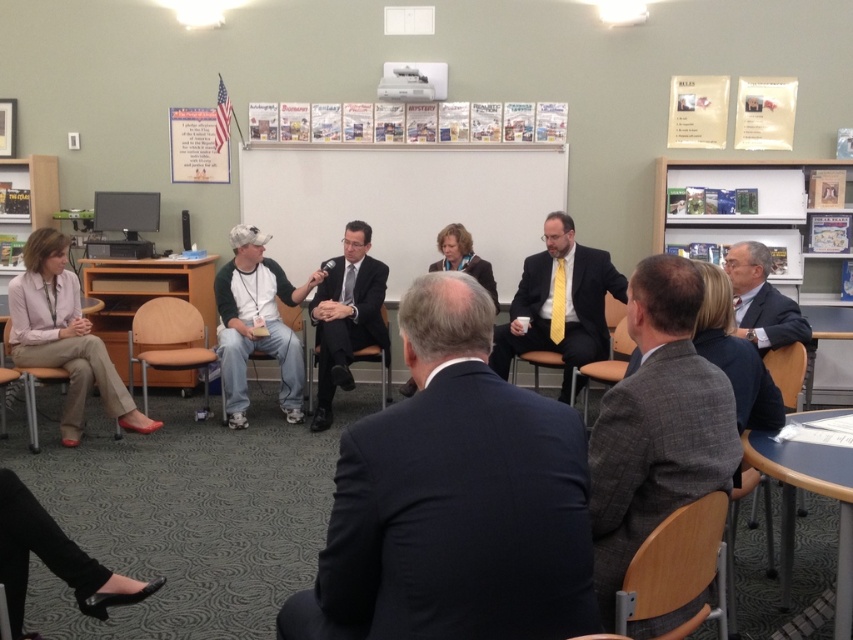
Question: Estimate the real-world distances between objects in this image. Which object is closer to the gray wool suit at center?

Choices:
 (A) brown leather chair at center
 (B) matte black suit at center
 (C) dark blue suit at center

Answer: (C)

Question: Does matte black suit at center have a larger size compared to brown wood chair at lower left?

Choices:
 (A) no
 (B) yes

Answer: (B)

Question: Which of these objects is positioned farthest from the dark blue suit at center?

Choices:
 (A) brown padded chair at lower left
 (B) wooden chair at lower right
 (C) blue laminate table at lower right

Answer: (A)

Question: Which point appears closest to the camera in this image?

Choices:
 (A) (415, 531)
 (B) (618, 374)

Answer: (A)

Question: Is brown wood chair at lower left bigger than brown leather chair at center?

Choices:
 (A) yes
 (B) no

Answer: (A)

Question: Does dark blue suit at center have a lesser width compared to gray wool suit at center?

Choices:
 (A) no
 (B) yes

Answer: (A)